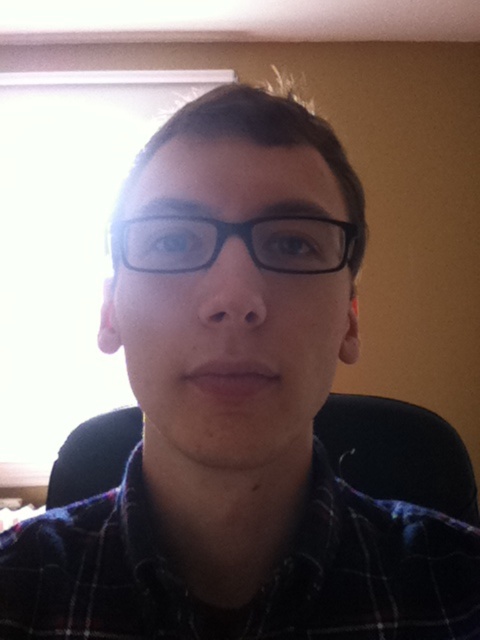
You are an interior designer assessing the seating arrangement in the room. You notice the plaid fabric at center and the black fabric swivel chair at center. Which object is shorter in height?

The plaid fabric at center is shorter in height compared to the black fabric swivel chair at center according to the description.

Based on the photo, you are a photographer adjusting the focus of your camera. You want to ensure both the black matte glasses at center and the plaid fabric at center are in focus. Which object should you adjust the focus towards first?

The black matte glasses at center has a greater height compared to plaid fabric at center, so you should adjust the focus towards the black matte glasses at center first to ensure both are in focus.